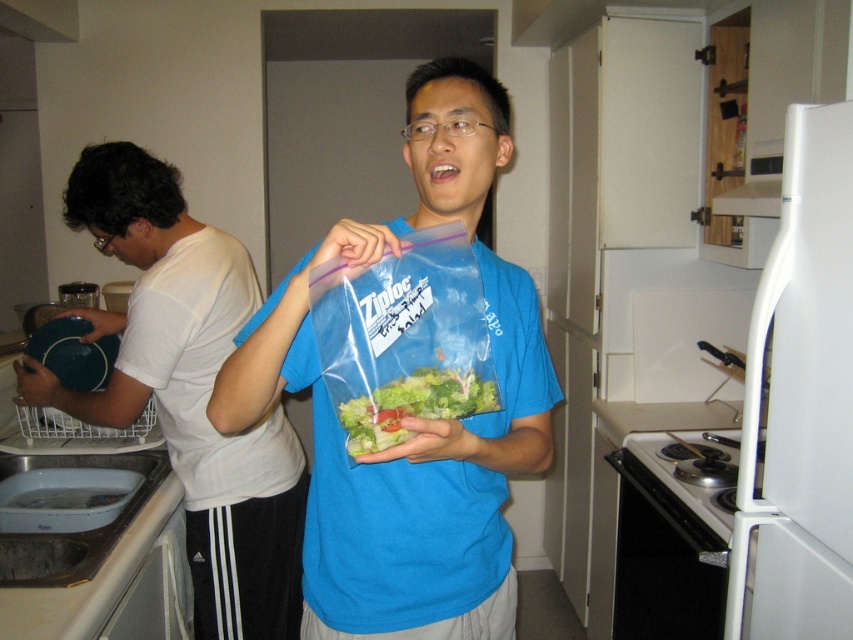
Question: In this image, where is transparent plastic bag of salad at center located relative to translucent plastic salad at center?

Choices:
 (A) below
 (B) above

Answer: (B)

Question: Which object is farther from the camera taking this photo?

Choices:
 (A) translucent plastic salad at center
 (B) transparent plastic bag of salad at center
 (C) white matte shirt at left

Answer: (C)

Question: In this image, where is transparent plastic bag of salad at center located relative to translucent plastic salad at center?

Choices:
 (A) left
 (B) right

Answer: (B)

Question: Among these objects, which one is farthest from the camera?

Choices:
 (A) transparent plastic bag of salad at center
 (B) white matte shirt at left

Answer: (B)

Question: Does transparent plastic bag of salad at center appear under translucent plastic salad at center?

Choices:
 (A) yes
 (B) no

Answer: (B)

Question: Which point is farther to the camera?

Choices:
 (A) white matte shirt at left
 (B) translucent plastic salad at center

Answer: (A)